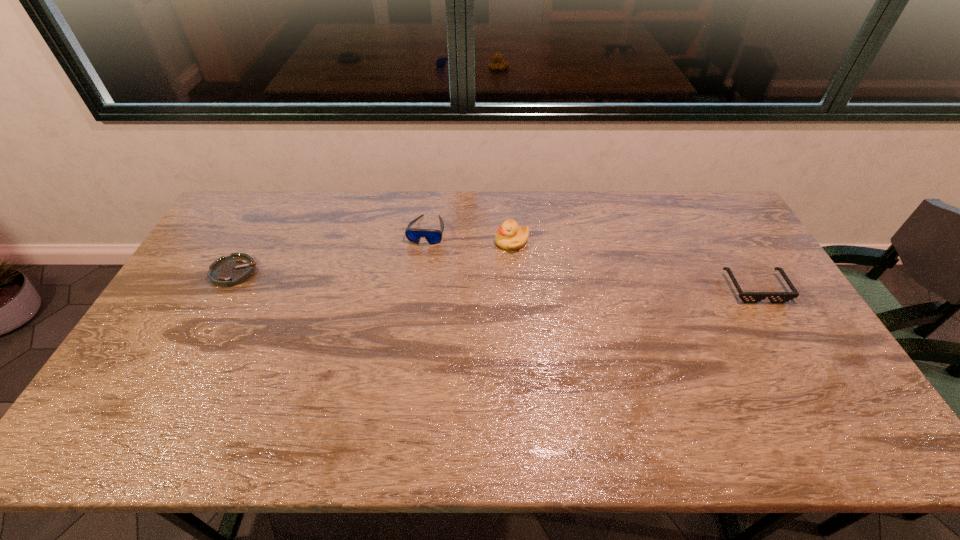
Where is `vacant space on the desktop that is between the ashtray and the nearer sunglasses and is positioned at the face of the tallest object`? Image resolution: width=960 pixels, height=540 pixels. vacant space on the desktop that is between the ashtray and the nearer sunglasses and is positioned at the face of the tallest object is located at coordinates tap(436, 278).

I want to click on free spot on the desktop that is between the ashtray and the right sunglasses and is positioned on the front-facing side of the third object from right to left, so click(x=415, y=278).